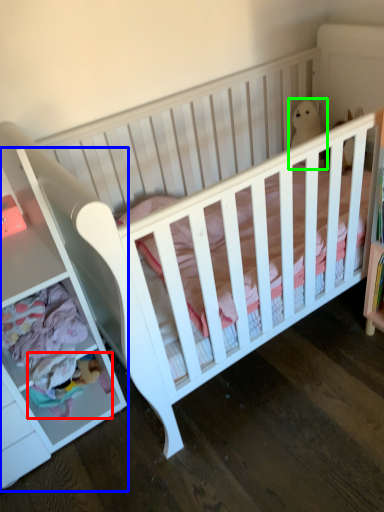
Question: Which object is the closest to the toy (highlighted by a red box)? Choose among these: dresser (highlighted by a blue box) or animal (highlighted by a green box).

Choices:
 (A) dresser
 (B) animal

Answer: (A)